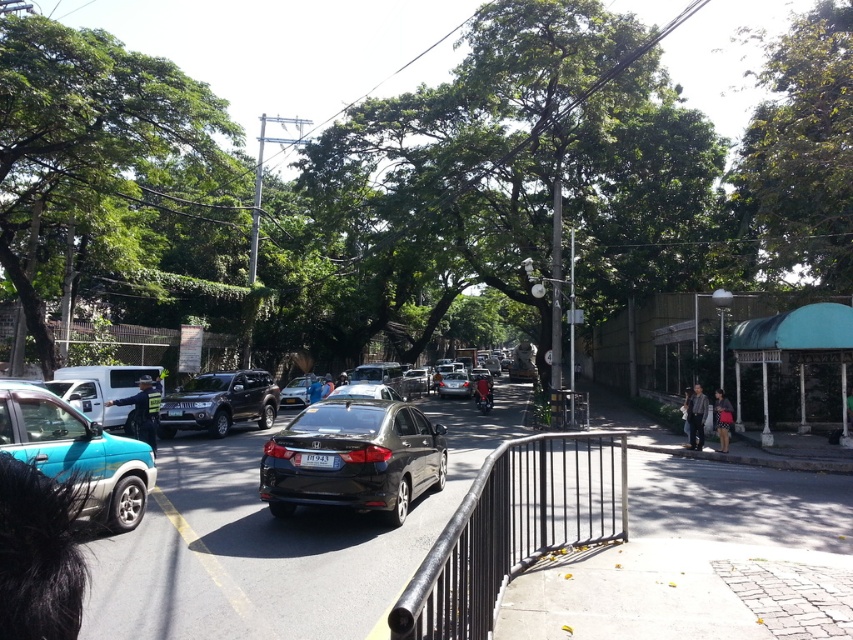
Which is behind, point (396, 456) or point (315, 380)?

Positioned behind is point (315, 380).

Is matte black sedan at center closer to camera compared to matte black car at center?

That is True.

Locate an element on the screen. The height and width of the screenshot is (640, 853). matte black sedan at center is located at coordinates (352, 458).

Is black metal railing at center closer to the viewer compared to satin black suv at center?

Yes.

Between black metal railing at center and satin black suv at center, which one appears on the right side from the viewer's perspective?

black metal railing at center

Find the location of `black metal railing at center`. black metal railing at center is located at coordinates (514, 529).

Who is lower down, teal matte suv at lower left or matte black car at center?

matte black car at center is lower down.

Does teal matte suv at lower left have a greater width compared to matte black car at center?

Correct, the width of teal matte suv at lower left exceeds that of matte black car at center.

At what (x,y) coordinates should I click in order to perform the action: click on teal matte suv at lower left. Please return your answer as a coordinate pair (x, y). Image resolution: width=853 pixels, height=640 pixels. Looking at the image, I should click on (77, 452).